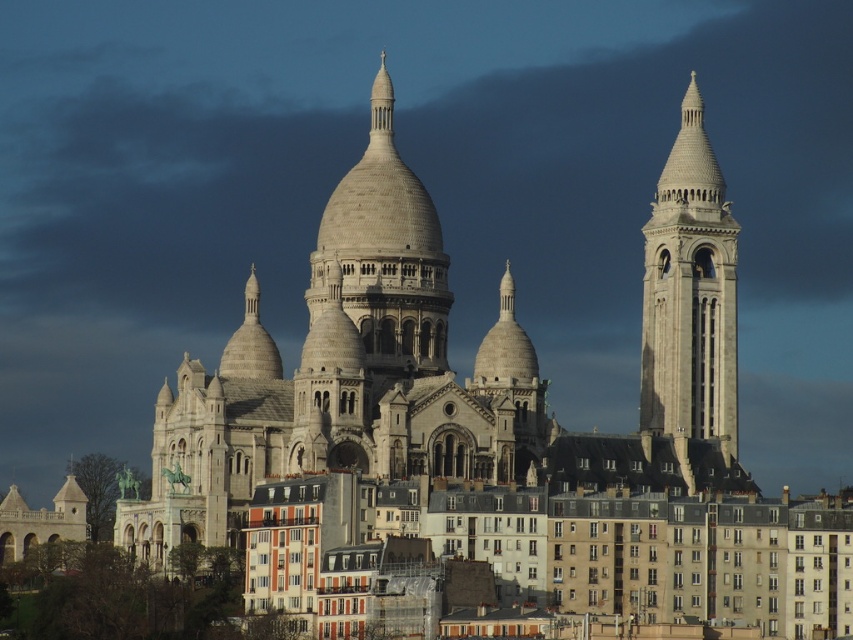
Who is positioned more to the left, white stone tower at right or beige stone dome at center?

From the viewer's perspective, beige stone dome at center appears more on the left side.

Does white stone tower at right appear on the left side of beige stone dome at center?

In fact, white stone tower at right is to the right of beige stone dome at center.

Locate an element on the screen. The width and height of the screenshot is (853, 640). white stone tower at right is located at coordinates (689, 292).